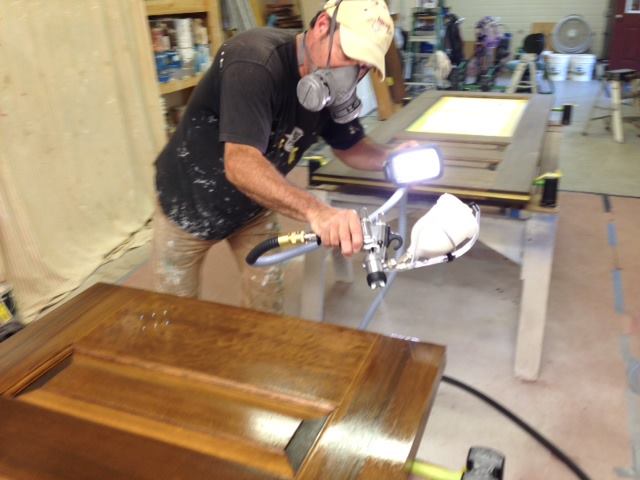
You are a GUI agent. You are given a task and a screenshot of the screen. Output one action in this format:
    pyautogui.click(x=<x>, y=<y>)
    Task: Click on the highly polished door
    This screenshot has height=480, width=640.
    Given the screenshot: What is the action you would take?
    pyautogui.click(x=269, y=342), pyautogui.click(x=381, y=427), pyautogui.click(x=209, y=409), pyautogui.click(x=59, y=336)